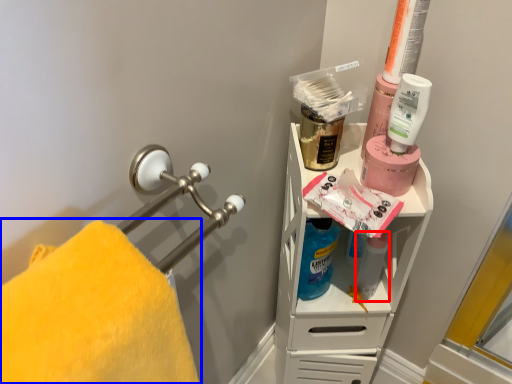
Question: Which object is closer to the camera taking this photo, cleaning product (highlighted by a red box) or towel (highlighted by a blue box)?

Choices:
 (A) cleaning product
 (B) towel

Answer: (B)